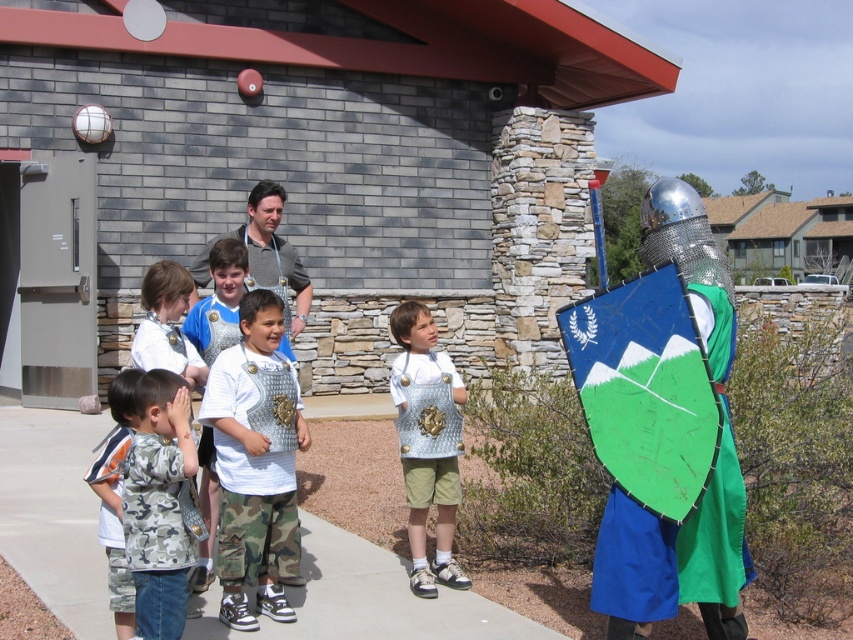
In the scene shown: Does shiny metallic helmet at right appear on the left side of camo fabric shirt at left?

In fact, shiny metallic helmet at right is to the right of camo fabric shirt at left.

I want to click on shiny metallic helmet at right, so click(x=711, y=474).

Does point (686, 564) come closer to viewer compared to point (154, 556)?

No, (686, 564) is further to viewer.

Identify the location of shiny metallic helmet at right. The image size is (853, 640). (711, 474).

The width and height of the screenshot is (853, 640). In order to click on shiny metallic helmet at right in this screenshot , I will do `click(711, 474)`.

Is shiny metallic helmet at right shorter than metallic armor at center?

Incorrect, shiny metallic helmet at right's height does not fall short of metallic armor at center's.

Locate an element on the screen. Image resolution: width=853 pixels, height=640 pixels. shiny metallic helmet at right is located at coordinates (711, 474).

Locate an element on the screen. This screenshot has height=640, width=853. shiny metallic helmet at right is located at coordinates (711, 474).

Is camo fabric shirt at left to the left of metallic silver armor at center from the viewer's perspective?

Yes, camo fabric shirt at left is to the left of metallic silver armor at center.

Image resolution: width=853 pixels, height=640 pixels. Find the location of `camo fabric shirt at left`. camo fabric shirt at left is located at coordinates (160, 504).

This screenshot has width=853, height=640. What do you see at coordinates (160, 504) in the screenshot? I see `camo fabric shirt at left` at bounding box center [160, 504].

Image resolution: width=853 pixels, height=640 pixels. What are the coordinates of `camo fabric shirt at left` in the screenshot? It's located at (160, 504).